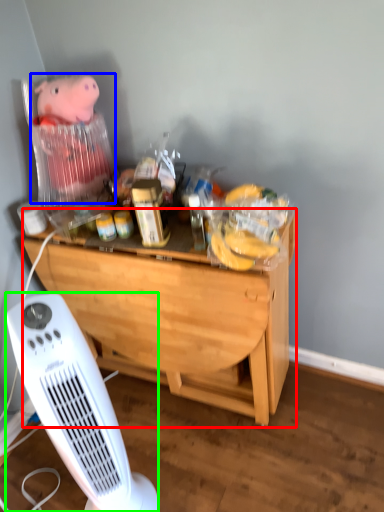
Question: Based on their relative distances, which object is farther from desk (highlighted by a red box)? Choose from toy (highlighted by a blue box) and home appliance (highlighted by a green box).

Choices:
 (A) toy
 (B) home appliance

Answer: (A)